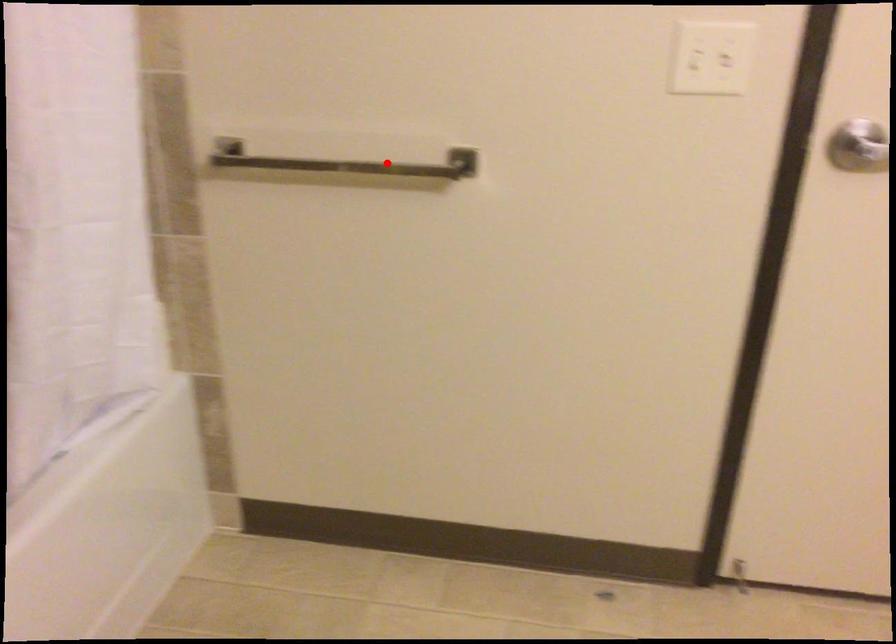
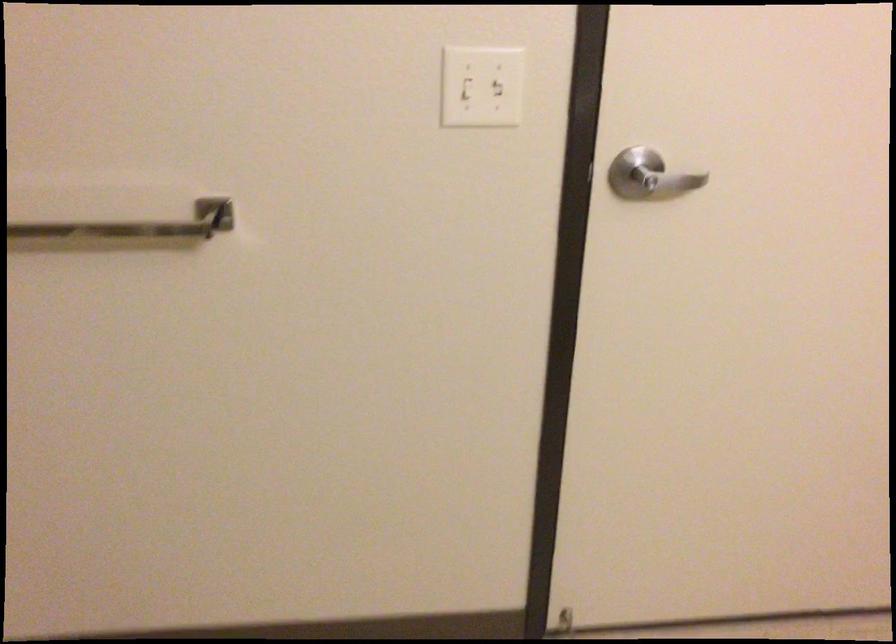
Question: I am providing you with two images of the same scene from different viewpoints. Given a red point in image1, look at the same physical point in image2. Is it:

Choices:
 (A) Closer to the viewpoint
 (B) Farther from the viewpoint

Answer: (A)